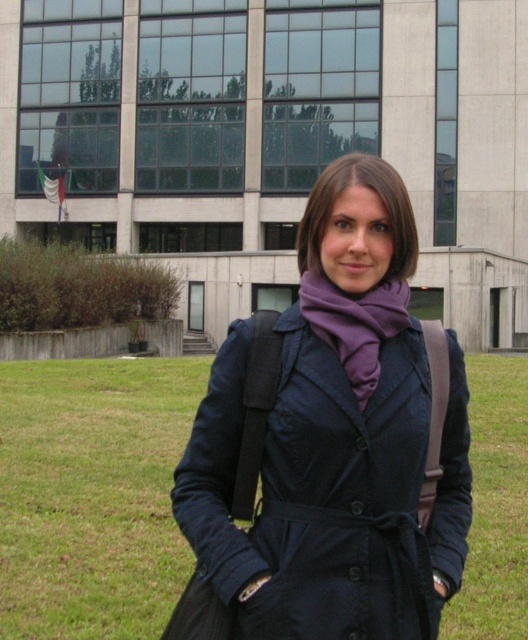
Question: Is green grass at lower center positioned at the back of purple soft scarf at center?

Choices:
 (A) no
 (B) yes

Answer: (B)

Question: Can you confirm if matte black coat at center is thinner than green grass at lower center?

Choices:
 (A) no
 (B) yes

Answer: (B)

Question: Which of the following is the closest to the observer?

Choices:
 (A) green grass at lower center
 (B) matte black coat at center

Answer: (B)

Question: Is matte black coat at center to the right of purple soft scarf at center from the viewer's perspective?

Choices:
 (A) yes
 (B) no

Answer: (A)

Question: Which object is the farthest from the purple soft scarf at center?

Choices:
 (A) purple matte scarf at center
 (B) green grass at lower center

Answer: (B)

Question: Which point is closer to the camera taking this photo?

Choices:
 (A) (338, 304)
 (B) (476, 602)
 (C) (403, 193)
 (D) (420, 433)

Answer: (D)